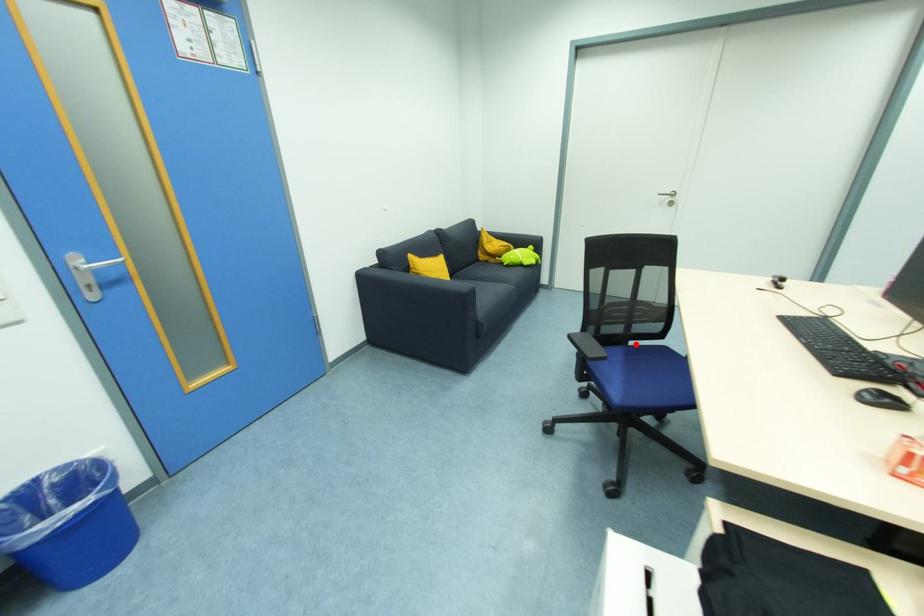
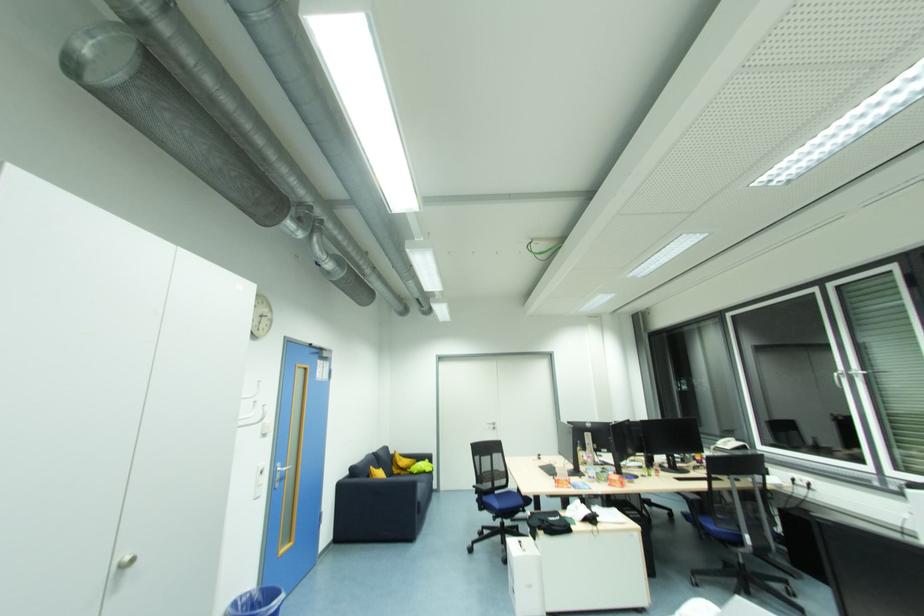
Where in the second image is the point corresponding to the highlighted location from the first image?

(500, 493)